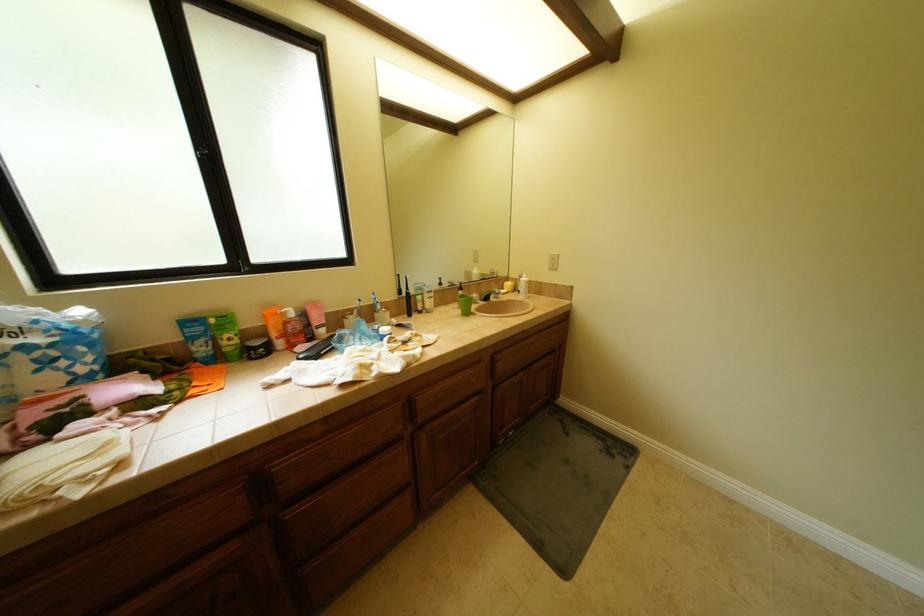
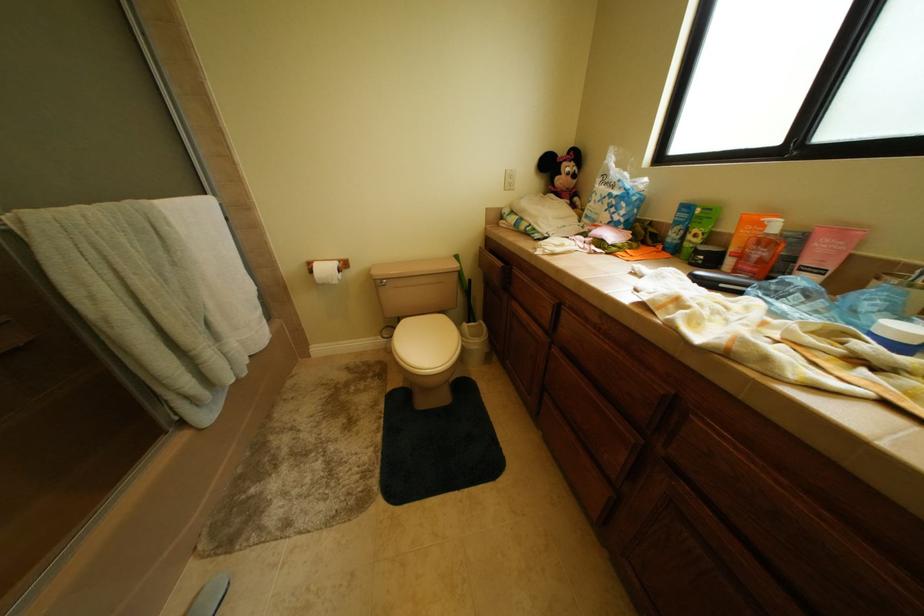
The images are taken continuously from a first-person perspective. In which direction is your viewpoint rotating?

The rotation direction of the camera is left-down.